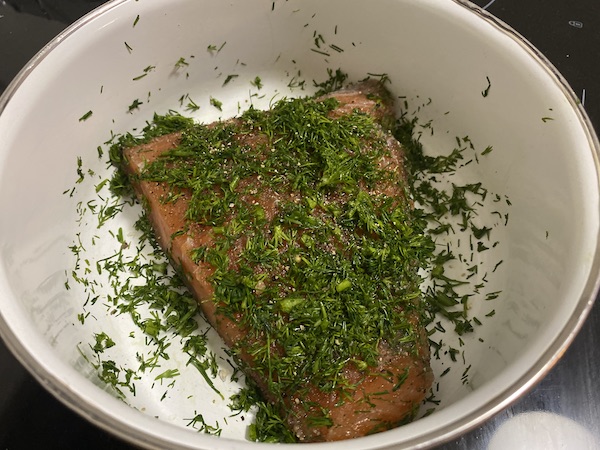
The image size is (600, 450). I want to click on empty space at top right corner, so pyautogui.click(x=588, y=5).